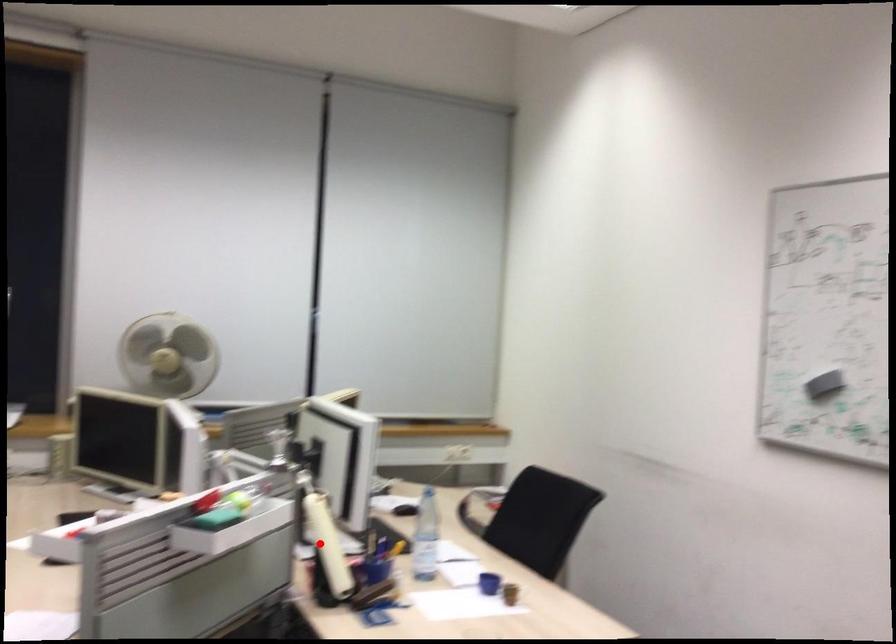
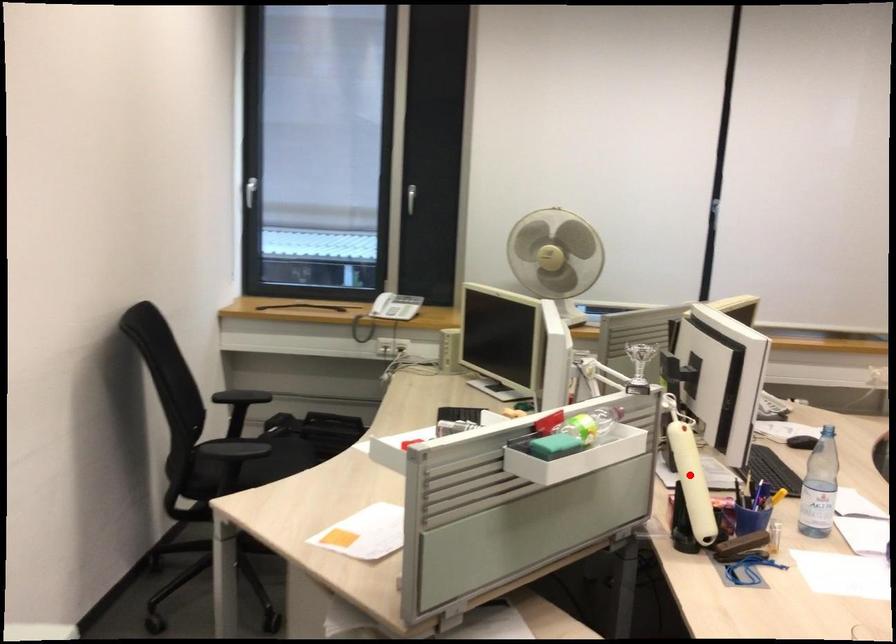
I am providing you with two images of the same scene from different viewpoints. A red point is marked on the first image and another point is marked on the second image. Is the marked point in image1 the same physical position as the marked point in image2?

Yes